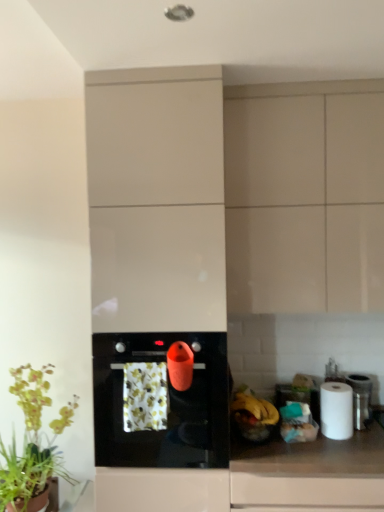
This screenshot has height=512, width=384. Find the location of `vacant area located to the right-hand side of white matte paper towel at right`. vacant area located to the right-hand side of white matte paper towel at right is located at coordinates (371, 435).